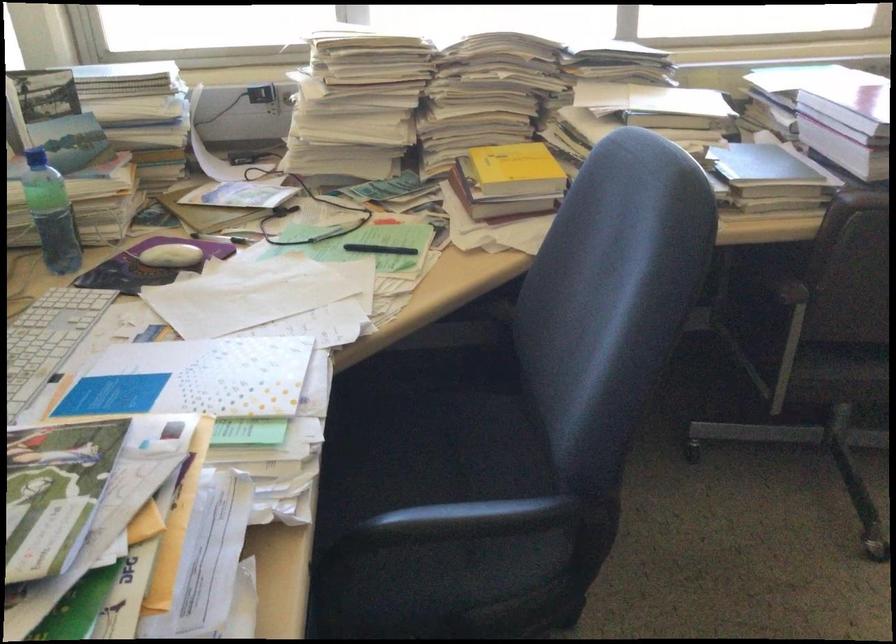
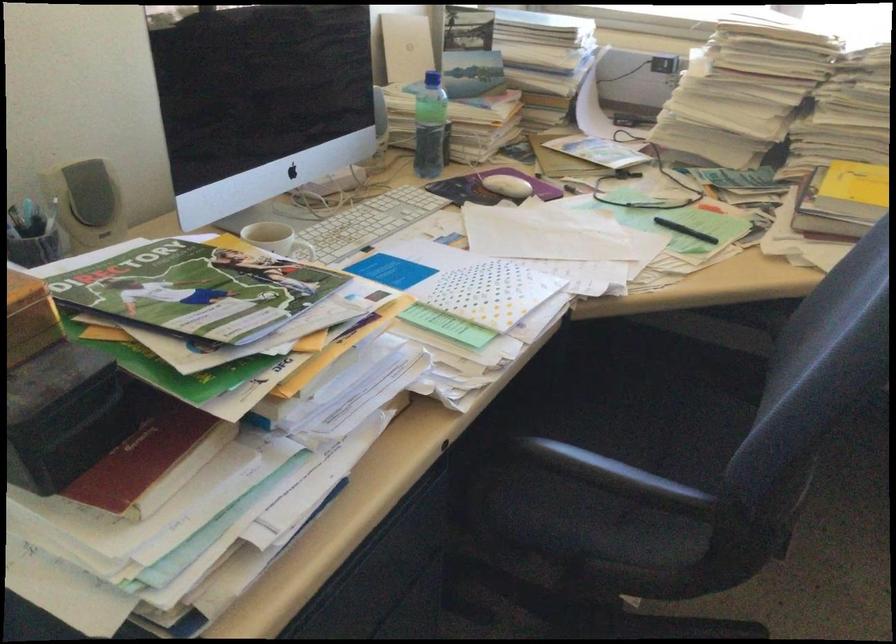
Locate, in the second image, the point that corresponds to point (511, 174) in the first image.

(853, 194)